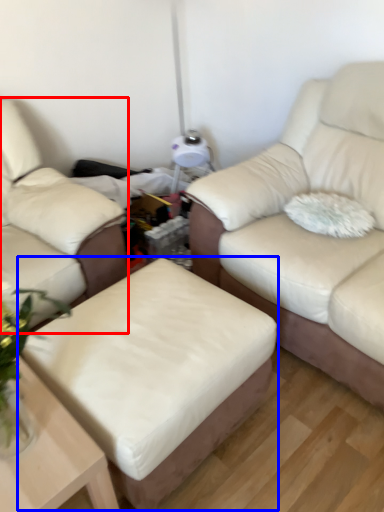
Question: Which point is closer to the camera, studio couch (highlighted by a red box) or stool (highlighted by a blue box)?

Choices:
 (A) studio couch
 (B) stool

Answer: (B)